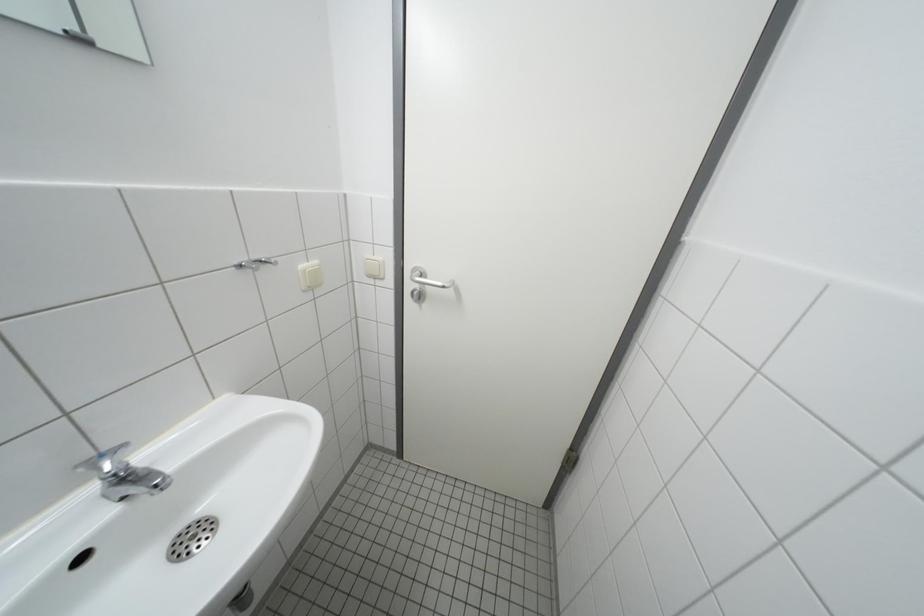
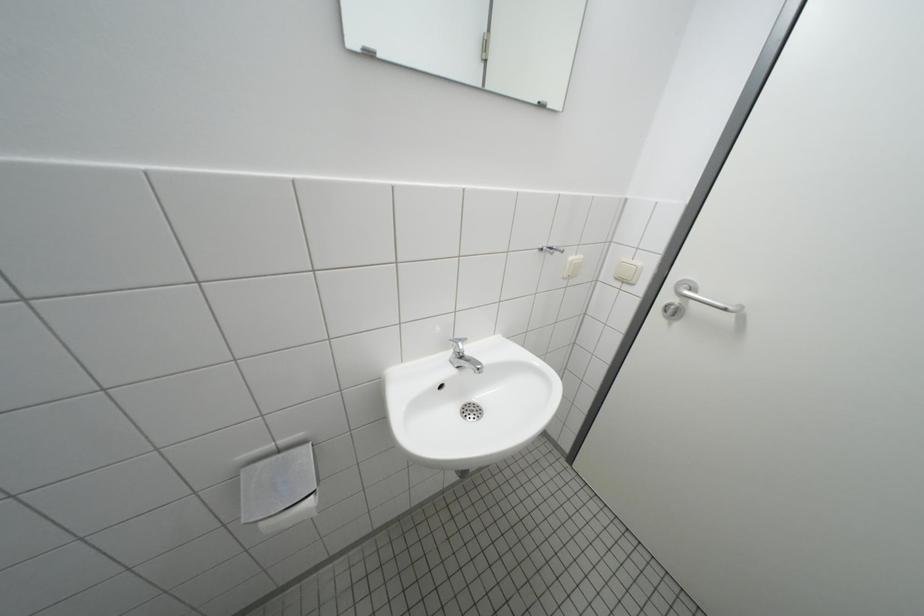
Question: The images are taken continuously from a first-person perspective. In which direction is your viewpoint rotating?

Choices:
 (A) Left
 (B) Right
 (C) Up
 (D) Down

Answer: (A)